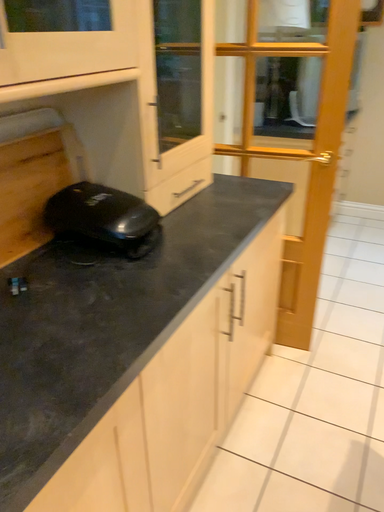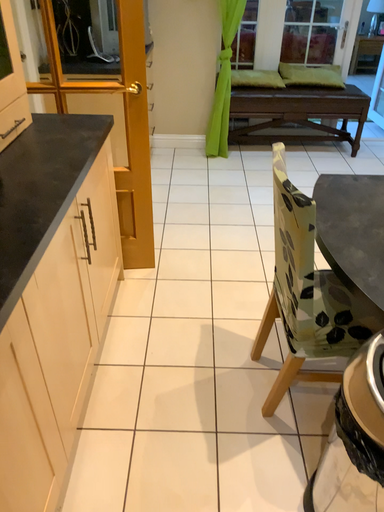
Question: Which way did the camera rotate in the video?

Choices:
 (A) rotated right
 (B) rotated left

Answer: (A)